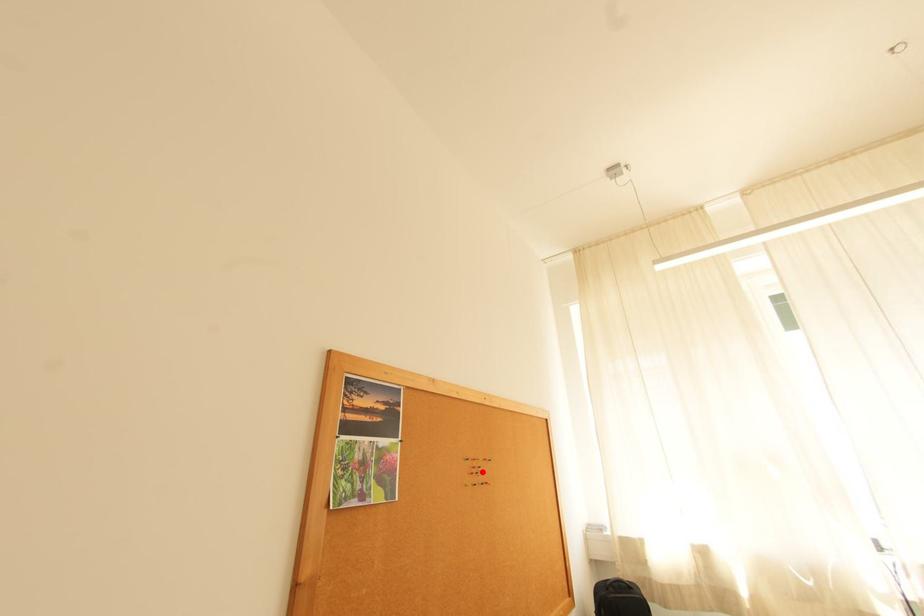
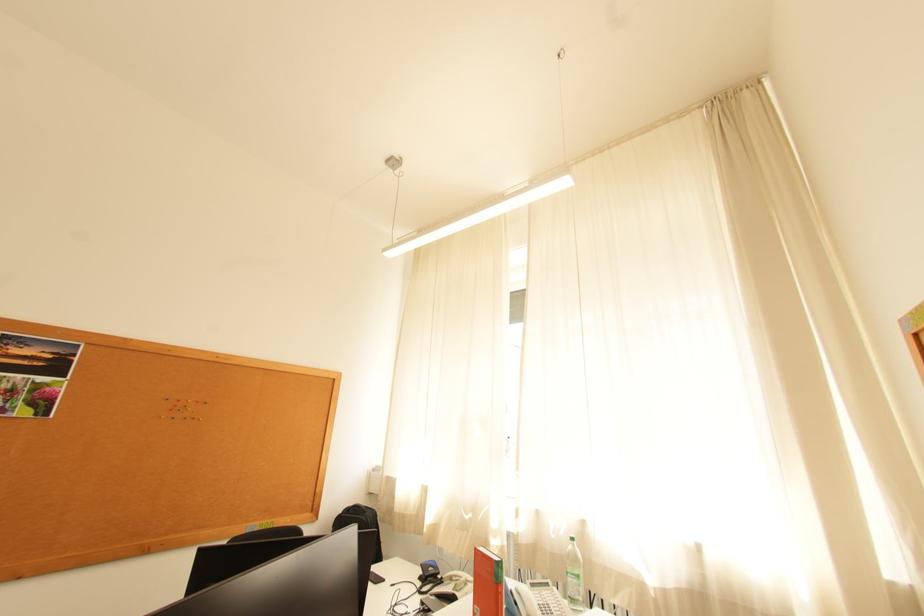
In the second image, find the point that corresponds to the highlighted location in the first image.

(186, 408)